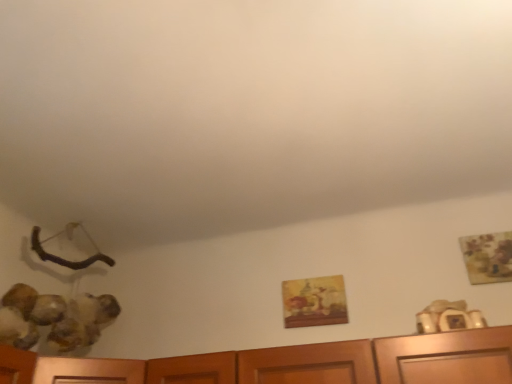
Question: Do you think matte wooden picture frame at center, acting as the 2th picture frame starting from the front, is within wooden painted picture frame at upper right, the second picture frame positioned from the bottom, or outside of it?

Choices:
 (A) outside
 (B) inside

Answer: (A)

Question: From a real-world perspective, is matte wooden picture frame at center, which is the 1th picture frame from bottom to top, above or below wooden painted picture frame at upper right, the second picture frame positioned from the bottom?

Choices:
 (A) above
 (B) below

Answer: (B)

Question: Based on their positions, is matte wooden picture frame at center, marked as the first picture frame in a left-to-right arrangement, located to the left or right of wooden painted picture frame at upper right, which is counted as the 1th picture frame, starting from the front?

Choices:
 (A) left
 (B) right

Answer: (A)

Question: In terms of size, does wooden painted picture frame at upper right, which is the 1th picture frame from right to left, appear bigger or smaller than matte wooden picture frame at center, which is the 1th picture frame from bottom to top?

Choices:
 (A) big
 (B) small

Answer: (B)

Question: From the image's perspective, relative to matte wooden picture frame at center, placed as the 1th picture frame when sorted from back to front, is wooden painted picture frame at upper right, which is counted as the 2th picture frame, starting from the left, above or below?

Choices:
 (A) below
 (B) above

Answer: (B)

Question: Considering the positions of wooden painted picture frame at upper right, the first picture frame viewed from the top, and matte wooden picture frame at center, positioned as the second picture frame in right-to-left order, in the image, is wooden painted picture frame at upper right, the first picture frame viewed from the top, taller or shorter than matte wooden picture frame at center, positioned as the second picture frame in right-to-left order,?

Choices:
 (A) tall
 (B) short

Answer: (A)

Question: In terms of width, does wooden painted picture frame at upper right, the second picture frame viewed from the back, look wider or thinner when compared to matte wooden picture frame at center, acting as the 2th picture frame starting from the front?

Choices:
 (A) wide
 (B) thin

Answer: (B)